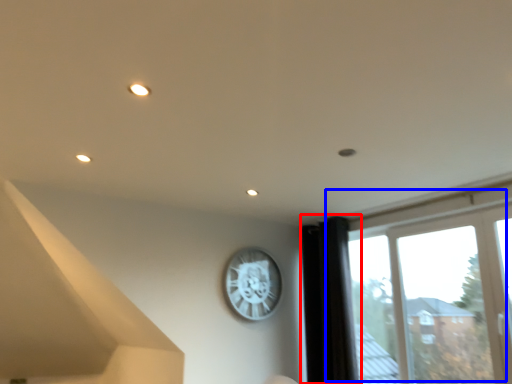
Question: Which object is further to the camera taking this photo, curtain (highlighted by a red box) or window (highlighted by a blue box)?

Choices:
 (A) curtain
 (B) window

Answer: (A)